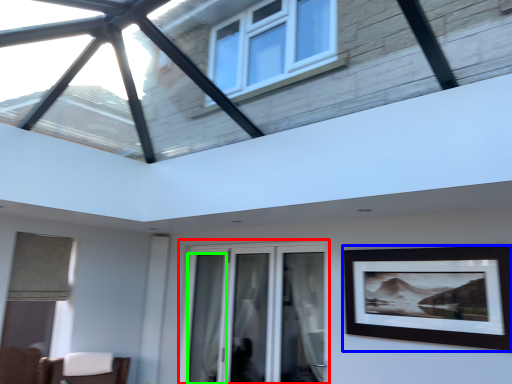
Question: Considering the real-world distances, which object is farthest from window (highlighted by a red box)? picture frame (highlighted by a blue box) or curtain (highlighted by a green box)?

Choices:
 (A) picture frame
 (B) curtain

Answer: (A)